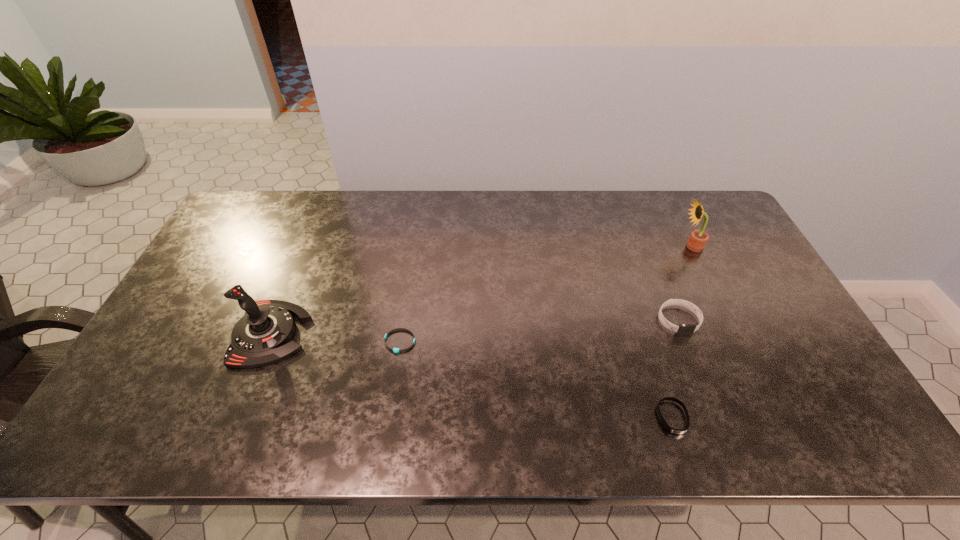
The width and height of the screenshot is (960, 540). What are the coordinates of `vacant area that lies between the second object from right to left and the joystick` in the screenshot? It's located at (474, 327).

At what (x,y) coordinates should I click in order to perform the action: click on empty space that is in between the second shortest wristband and the third tallest object. Please return your answer as a coordinate pair (x, y). The width and height of the screenshot is (960, 540). Looking at the image, I should click on (675, 369).

Locate which object ranks fourth in proximity to the joystick. Please provide its 2D coordinates. Your answer should be formatted as a tuple, i.e. [(x, y)], where the tuple contains the x and y coordinates of a point satisfying the conditions above.

[(698, 238)]

Locate an element on the screen. This screenshot has height=540, width=960. object identified as the closest to the shortest object is located at coordinates (262, 336).

Select which wristband is the third closest to the leftmost object. Please provide its 2D coordinates. Your answer should be formatted as a tuple, i.e. [(x, y)], where the tuple contains the x and y coordinates of a point satisfying the conditions above.

[(683, 329)]

Identify which wristband is the third nearest to the sunflower. Please provide its 2D coordinates. Your answer should be formatted as a tuple, i.e. [(x, y)], where the tuple contains the x and y coordinates of a point satisfying the conditions above.

[(396, 350)]

Image resolution: width=960 pixels, height=540 pixels. In order to click on free space that satisfies the following two spatial constraints: 1. on the face of the rightmost object; 2. on the buckle of the leftmost wristband in this screenshot , I will do `click(738, 341)`.

Where is `vacant region that satisfies the following two spatial constraints: 1. on the face of the rightmost object; 2. on the display of the second shortest object`? This screenshot has height=540, width=960. vacant region that satisfies the following two spatial constraints: 1. on the face of the rightmost object; 2. on the display of the second shortest object is located at coordinates click(777, 417).

The image size is (960, 540). I want to click on free spot that satisfies the following two spatial constraints: 1. on the face of the farthest object; 2. on the outer surface of the second object from right to left, so click(729, 321).